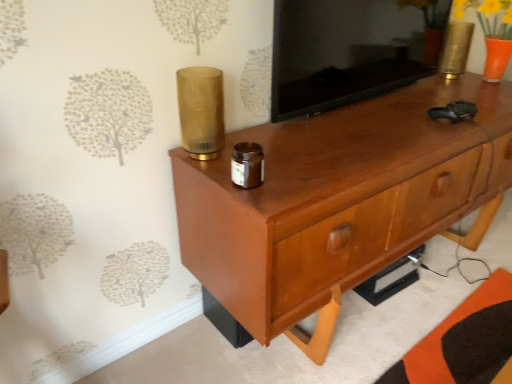
This screenshot has width=512, height=384. I want to click on vacant space underneath matte wood tv cabinet at upper center (from a real-world perspective), so click(x=364, y=98).